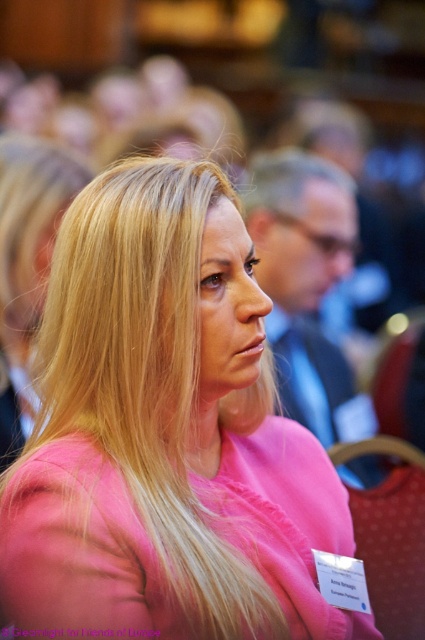
Question: Is pink matte shirt at center to the right of pink fabric shirt at center from the viewer's perspective?

Choices:
 (A) yes
 (B) no

Answer: (B)

Question: Does pink matte shirt at center have a greater width compared to pink fabric shirt at center?

Choices:
 (A) no
 (B) yes

Answer: (B)

Question: Can you confirm if pink matte shirt at center is positioned to the right of pink fabric shirt at center?

Choices:
 (A) yes
 (B) no

Answer: (B)

Question: Which point is farther to the camera?

Choices:
 (A) (300, 513)
 (B) (299, 170)

Answer: (B)

Question: Among these points, which one is farthest from the camera?

Choices:
 (A) (274, 353)
 (B) (246, 412)

Answer: (A)